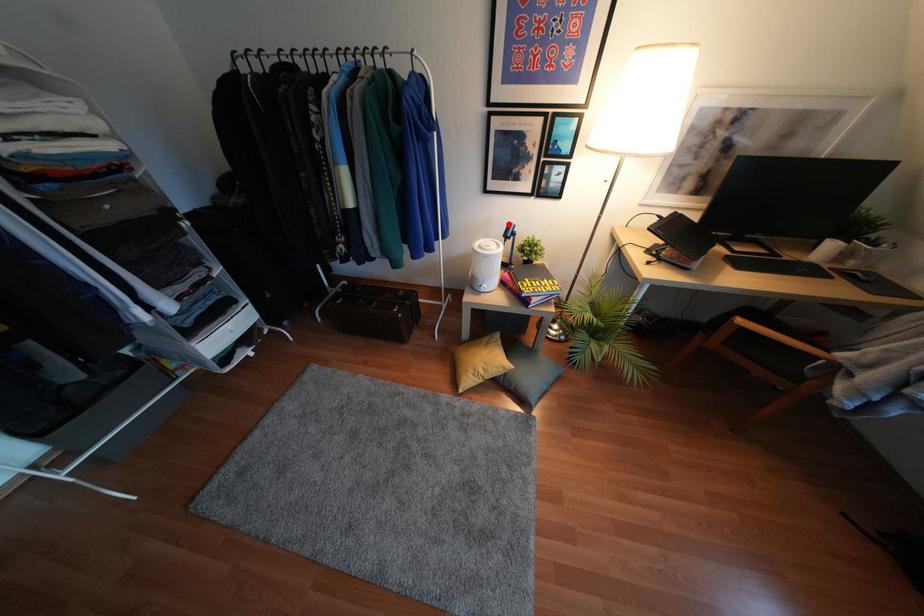
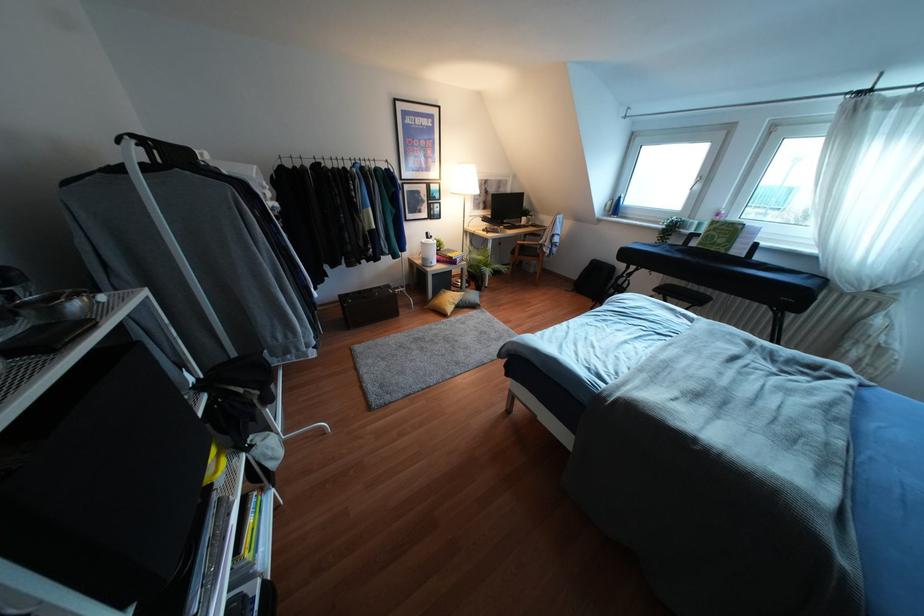
In the second image, find the point that corresponds to the highlighted location in the first image.

(427, 233)